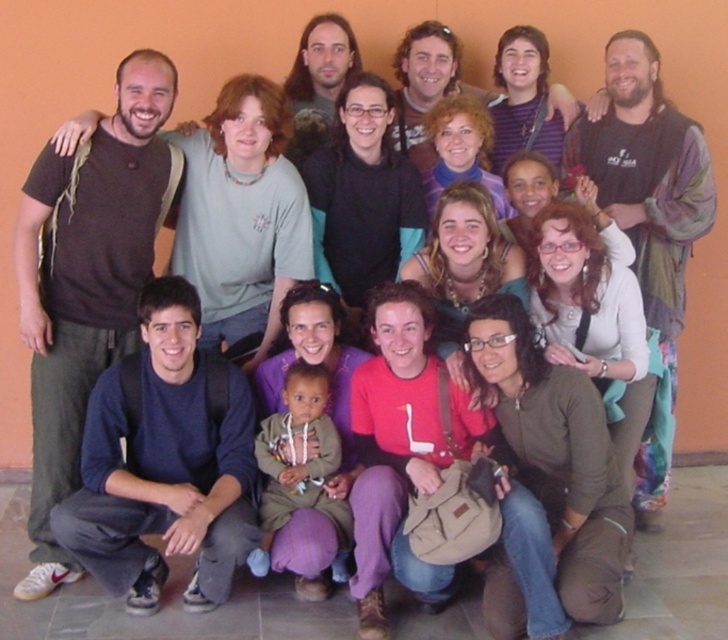
The height and width of the screenshot is (640, 728). Describe the element at coordinates (87, 282) in the screenshot. I see `brown matte t-shirt at left` at that location.

At what (x,y) coordinates should I click in order to perform the action: click on brown matte t-shirt at left. Please return your answer as a coordinate pair (x, y). Looking at the image, I should click on (87, 282).

What do you see at coordinates (87, 282) in the screenshot? The image size is (728, 640). I see `brown matte t-shirt at left` at bounding box center [87, 282].

Find the location of `brown matte t-shirt at left`. brown matte t-shirt at left is located at coordinates (87, 282).